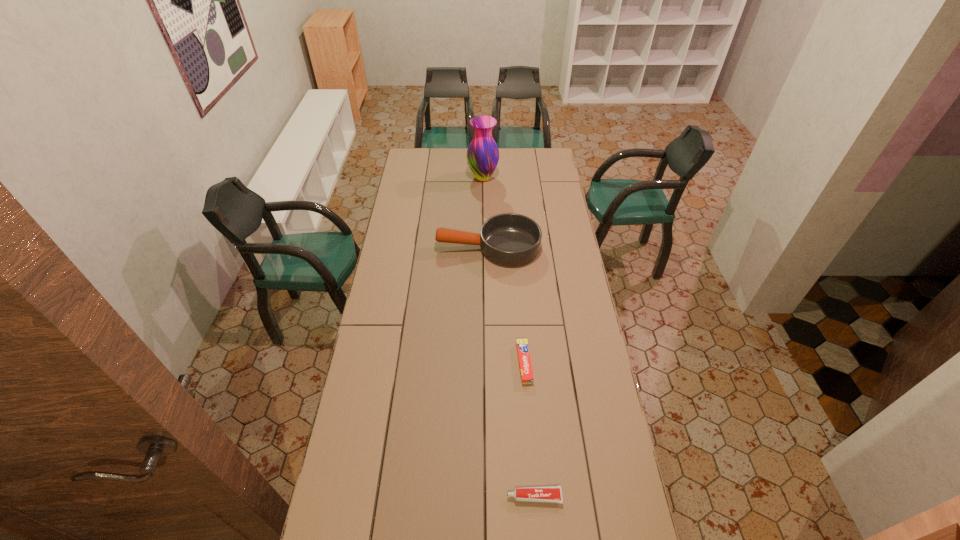
At what (x,y) coordinates should I click in order to perform the action: click on vase. Please return your answer as a coordinate pair (x, y). The height and width of the screenshot is (540, 960). Looking at the image, I should click on (x=482, y=154).

This screenshot has height=540, width=960. In order to click on the tallest object in this screenshot , I will do `click(482, 154)`.

Find the location of a particular element. the second farthest object is located at coordinates (509, 239).

This screenshot has width=960, height=540. What are the coordinates of `pan` in the screenshot? It's located at (509, 239).

Locate an element on the screen. This screenshot has width=960, height=540. the nearest object is located at coordinates (550, 494).

Locate an element on the screen. the third farthest object is located at coordinates (525, 367).

At what (x,y) coordinates should I click in order to perform the action: click on vacant region located on the right of the farthest object. Please return your answer as a coordinate pair (x, y). The image size is (960, 540). Looking at the image, I should click on (540, 178).

The height and width of the screenshot is (540, 960). I want to click on free space located 0.150m on the handle side of the pan, so click(x=405, y=247).

Locate an element on the screen. vacant region located on the handle side of the pan is located at coordinates (414, 247).

Where is `free location located 0.150m on the handle side of the pan`? This screenshot has height=540, width=960. free location located 0.150m on the handle side of the pan is located at coordinates (405, 247).